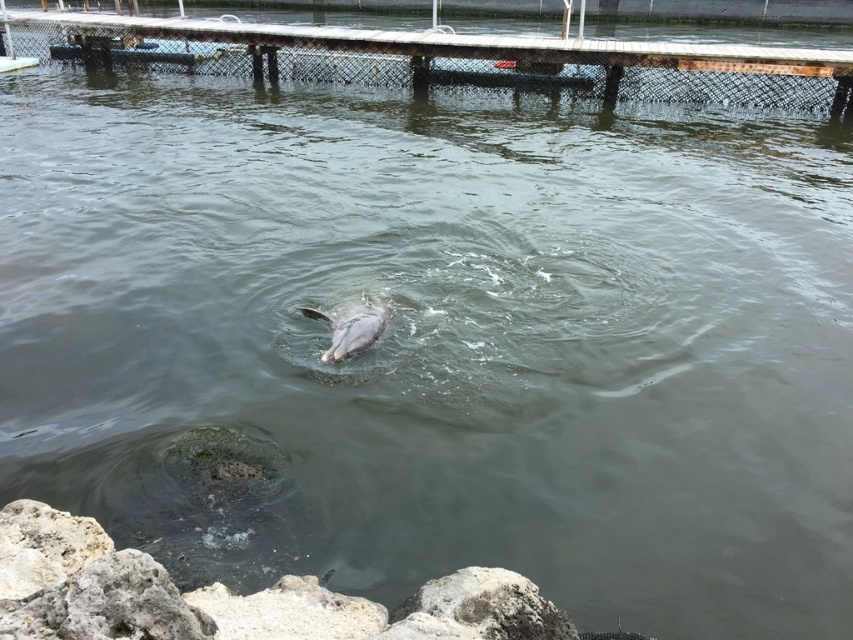
Question: From the image, what is the correct spatial relationship of gray rough rock at lower center in relation to gray matte dolphin at center?

Choices:
 (A) above
 (B) below

Answer: (B)

Question: Does wooden dock at upper center appear on the right side of gray matte dolphin at center?

Choices:
 (A) no
 (B) yes

Answer: (A)

Question: Estimate the real-world distances between objects in this image. Which object is closer to the gray rough rock at lower center?

Choices:
 (A) wooden dock at upper center
 (B) gray matte dolphin at center

Answer: (B)

Question: Which point is closer to the camera?

Choices:
 (A) gray rough rock at lower center
 (B) wooden dock at upper center
 (C) gray matte dolphin at center

Answer: (A)

Question: Which object is farther from the camera taking this photo?

Choices:
 (A) wooden dock at upper center
 (B) gray rough rock at lower center

Answer: (A)

Question: Does wooden dock at upper center have a larger size compared to gray rough rock at lower center?

Choices:
 (A) yes
 (B) no

Answer: (A)